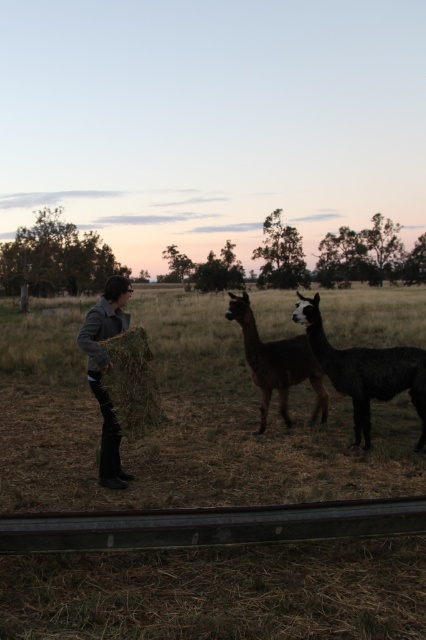
Can you confirm if dark brown woolly alpaca at right is shorter than gray woolen jacket at left?

Indeed, dark brown woolly alpaca at right has a lesser height compared to gray woolen jacket at left.

Does dark brown woolly alpaca at right appear on the left side of gray woolen jacket at left?

No, dark brown woolly alpaca at right is not to the left of gray woolen jacket at left.

Between point (400, 381) and point (118, 461), which one is positioned behind?

Point (400, 381)

In order to click on dark brown woolly alpaca at right in this screenshot , I will do `click(365, 371)`.

Is dark brown woolly alpaca at right taller than brown woolen alpaca at center?

Yes, dark brown woolly alpaca at right is taller than brown woolen alpaca at center.

Does point (351, 352) lie in front of point (264, 388)?

Yes, point (351, 352) is in front of point (264, 388).

The height and width of the screenshot is (640, 426). In order to click on dark brown woolly alpaca at right in this screenshot , I will do `click(365, 371)`.

Is brown woolen alpaca at center positioned before gray woolen jacket at left?

No, brown woolen alpaca at center is further to the viewer.

Is brown woolen alpaca at center above gray woolen jacket at left?

Actually, brown woolen alpaca at center is below gray woolen jacket at left.

This screenshot has height=640, width=426. I want to click on brown woolen alpaca at center, so (276, 364).

Identify the location of brown woolen alpaca at center. The width and height of the screenshot is (426, 640). (276, 364).